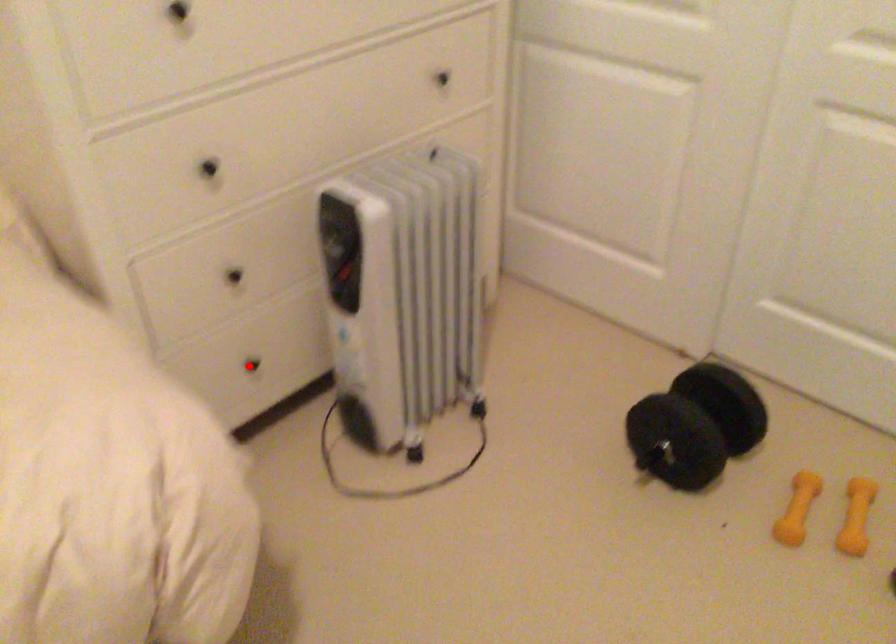
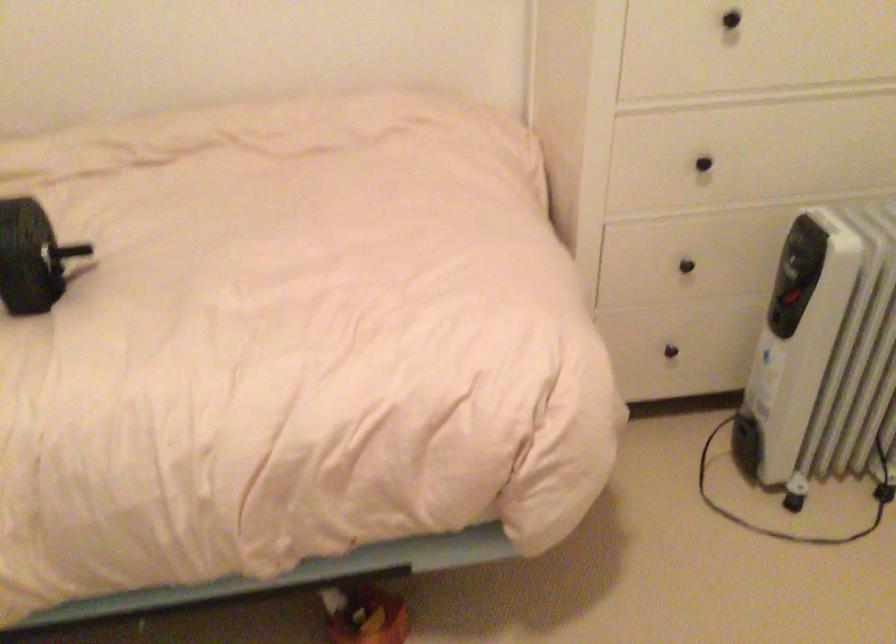
Where in the second image is the point corresponding to the highlighted location from the first image?

(670, 351)